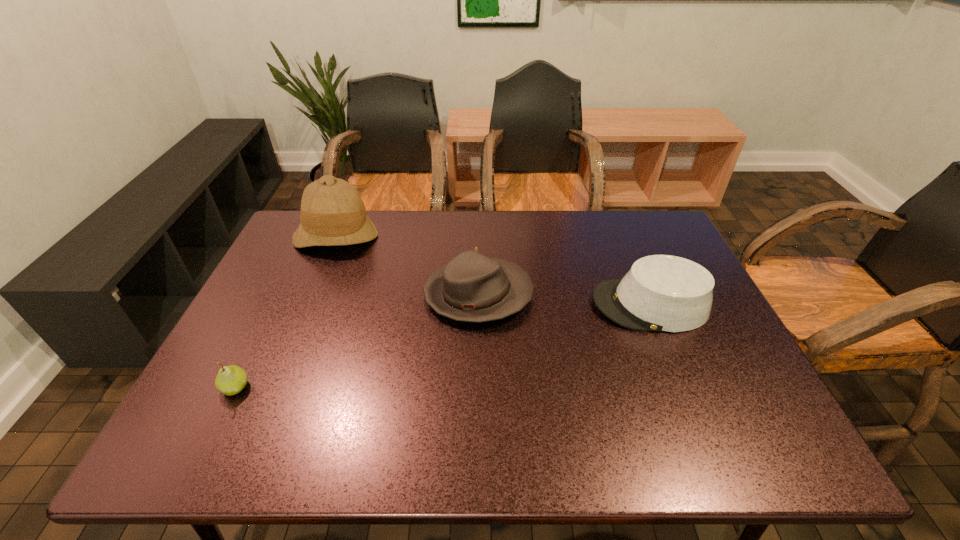
Choose which hat is the second nearest neighbor to the second hat from left to right. Please provide its 2D coordinates. Your answer should be formatted as a tuple, i.e. [(x, y)], where the tuple contains the x and y coordinates of a point satisfying the conditions above.

[(332, 213)]

You are a GUI agent. You are given a task and a screenshot of the screen. Output one action in this format:
    pyautogui.click(x=<x>, y=<y>)
    Task: Click on the third closest hat to the pear
    Image resolution: width=960 pixels, height=540 pixels.
    Given the screenshot: What is the action you would take?
    pyautogui.click(x=665, y=293)